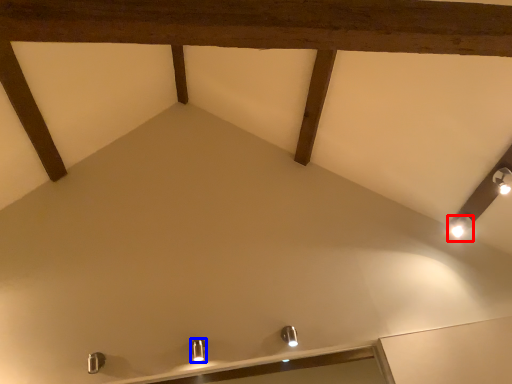
Question: Which point is closer to the camera, light fixture (highlighted by a red box) or light fixture (highlighted by a blue box)?

Choices:
 (A) light fixture
 (B) light fixture

Answer: (B)